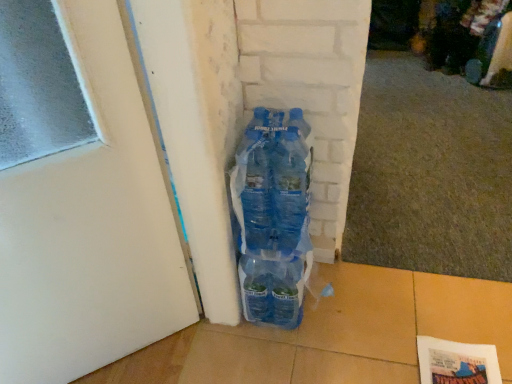
Question: Based on their positions, is white matte door at center located to the left or right of translucent plastic bottles at center?

Choices:
 (A) right
 (B) left

Answer: (B)

Question: In terms of height, does white matte door at center look taller or shorter compared to translucent plastic bottles at center?

Choices:
 (A) tall
 (B) short

Answer: (A)

Question: Is white matte door at center inside the boundaries of translucent plastic bottles at center, or outside?

Choices:
 (A) outside
 (B) inside

Answer: (A)

Question: Is point (257, 175) positioned closer to the camera than point (83, 54)?

Choices:
 (A) farther
 (B) closer

Answer: (A)

Question: From the image's perspective, is translucent plastic bottles at center positioned above or below white matte door at center?

Choices:
 (A) above
 (B) below

Answer: (A)

Question: Which is correct: translucent plastic bottles at center is inside white matte door at center, or outside of it?

Choices:
 (A) inside
 (B) outside

Answer: (B)

Question: From a real-world perspective, is translucent plastic bottles at center above or below white matte door at center?

Choices:
 (A) above
 (B) below

Answer: (B)